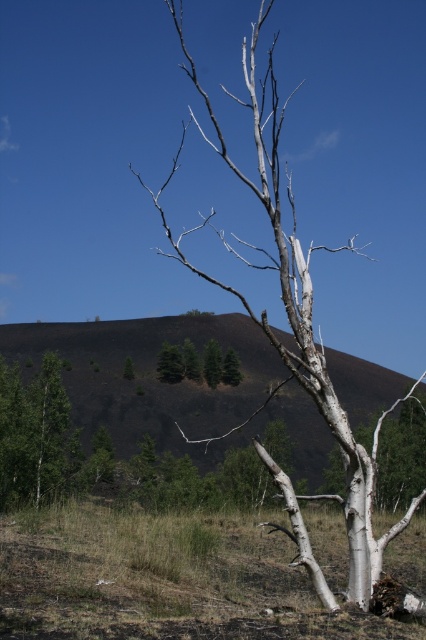
Question: Considering the relative positions of burnt soil at center and green matte trees at center in the image provided, where is burnt soil at center located with respect to green matte trees at center?

Choices:
 (A) below
 (B) above

Answer: (A)

Question: Which object is the farthest from the white bark birch tree at center?

Choices:
 (A) burnt soil at center
 (B) green matte trees at center

Answer: (B)

Question: Considering the real-world distances, which object is farthest from the burnt soil at center?

Choices:
 (A) white bark birch tree at center
 (B) green matte trees at center

Answer: (A)

Question: Does burnt soil at center appear over green matte trees at center?

Choices:
 (A) no
 (B) yes

Answer: (A)

Question: Can you confirm if burnt soil at center is smaller than green matte trees at center?

Choices:
 (A) no
 (B) yes

Answer: (A)

Question: Based on their relative distances, which object is farther from the green matte trees at center?

Choices:
 (A) burnt soil at center
 (B) white bark birch tree at center

Answer: (B)